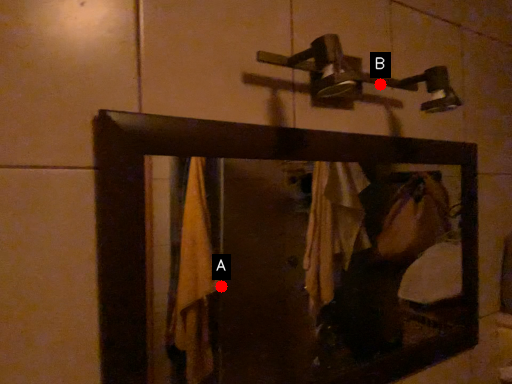
Question: Two points are circled on the image, labeled by A and B beside each circle. Which point is closer to the camera?

Choices:
 (A) A is closer
 (B) B is closer

Answer: (B)